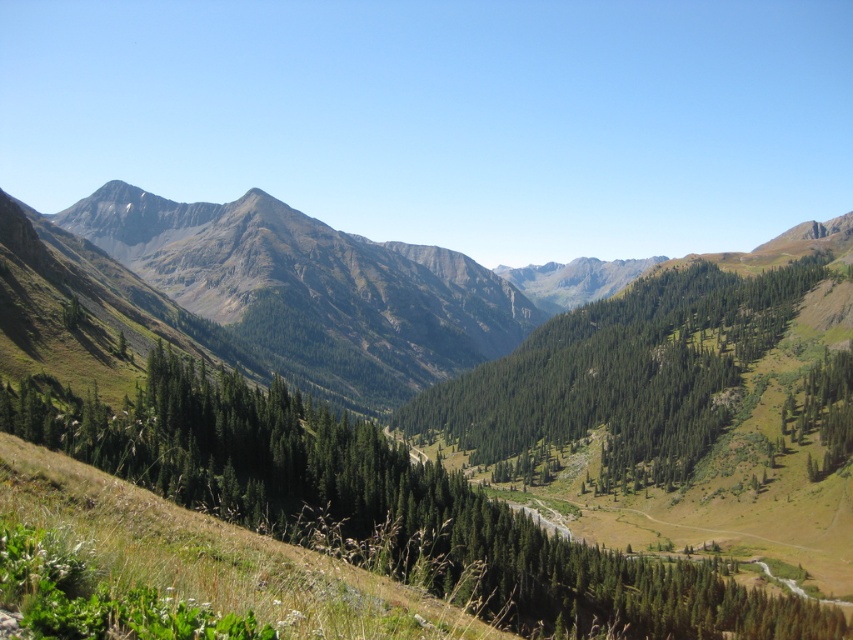
Question: Can you confirm if green grassy mountain at center is positioned below green textured trees at center?

Choices:
 (A) yes
 (B) no

Answer: (B)

Question: Can you confirm if green grassy mountain at center is bigger than green textured trees at center?

Choices:
 (A) no
 (B) yes

Answer: (B)

Question: Among these points, which one is farthest from the camera?

Choices:
 (A) (84, 454)
 (B) (677, 282)

Answer: (B)

Question: Where is green grassy mountain at center located in relation to green textured trees at center in the image?

Choices:
 (A) right
 (B) left

Answer: (B)

Question: Which of the following is the closest to the observer?

Choices:
 (A) (483, 387)
 (B) (105, 298)

Answer: (B)